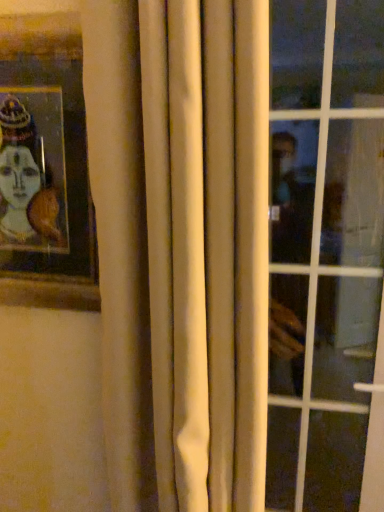
What do you see at coordinates (324, 248) in the screenshot?
I see `transparent glass window at right` at bounding box center [324, 248].

Locate an element on the screen. Image resolution: width=384 pixels, height=512 pixels. white fabric curtain at center is located at coordinates (207, 247).

How distant is white fabric curtain at center from wooden picture frame at upper left?

white fabric curtain at center and wooden picture frame at upper left are 11.51 inches apart.

Considering the positions of objects white fabric curtain at center and wooden picture frame at upper left in the image provided, who is in front, white fabric curtain at center or wooden picture frame at upper left?

Positioned in front is white fabric curtain at center.

From the image's perspective, which is above, white fabric curtain at center or wooden picture frame at upper left?

wooden picture frame at upper left.

Considering the relative sizes of white fabric curtain at center and wooden picture frame at upper left in the image provided, is white fabric curtain at center thinner than wooden picture frame at upper left?

In fact, white fabric curtain at center might be wider than wooden picture frame at upper left.

From a real-world perspective, which is physically below, wooden picture frame at upper left or white fabric curtain at center?

white fabric curtain at center.

Between wooden picture frame at upper left and white fabric curtain at center, which one has less height?

wooden picture frame at upper left.

Where is `curtain directly beneath the wooden picture frame at upper left (from a real-world perspective)`? curtain directly beneath the wooden picture frame at upper left (from a real-world perspective) is located at coordinates (207, 247).

Which is less distant, [299,326] or [226,102]?

Positioned in front is point [226,102].

From the picture: Which object is positioned more to the right, transparent glass window at right or white fabric curtain at center?

transparent glass window at right is more to the right.

Is transparent glass window at right beside white fabric curtain at center?

transparent glass window at right and white fabric curtain at center are not in contact.

Is transparent glass window at right positioned beyond the bounds of white fabric curtain at center?

Yes.

Who is taller, transparent glass window at right or wooden picture frame at upper left?

With more height is transparent glass window at right.

Is there a large distance between transparent glass window at right and wooden picture frame at upper left?

No, transparent glass window at right is in close proximity to wooden picture frame at upper left.

Considering the points (274, 498) and (62, 153), which point is behind, point (274, 498) or point (62, 153)?

The point (274, 498) is farther from the camera.

Considering the sizes of objects transparent glass window at right and wooden picture frame at upper left in the image provided, who is smaller, transparent glass window at right or wooden picture frame at upper left?

wooden picture frame at upper left.

In terms of width, does white fabric curtain at center look wider or thinner when compared to transparent glass window at right?

Clearly, white fabric curtain at center has more width compared to transparent glass window at right.

Would you consider white fabric curtain at center to be distant from transparent glass window at right?

Actually, white fabric curtain at center and transparent glass window at right are a little close together.

Could you tell me if white fabric curtain at center is turned towards transparent glass window at right?

No.

Which object is closer to the camera, white fabric curtain at center or transparent glass window at right?

white fabric curtain at center.

There is a transparent glass window at right. At what (x,y) coordinates should I click in order to perform the action: click on picture frame above it (from a real-world perspective). Please return your answer as a coordinate pair (x, y). This screenshot has width=384, height=512. Looking at the image, I should click on (45, 167).

Which is more to the right, wooden picture frame at upper left or transparent glass window at right?

transparent glass window at right.

From the image's perspective, relative to transparent glass window at right, is wooden picture frame at upper left above or below?

From the image's perspective, wooden picture frame at upper left appears above transparent glass window at right.

Are wooden picture frame at upper left and transparent glass window at right located far from each other?

No, wooden picture frame at upper left is not far from transparent glass window at right.

Where is `curtain in front of the wooden picture frame at upper left`? Image resolution: width=384 pixels, height=512 pixels. curtain in front of the wooden picture frame at upper left is located at coordinates (207, 247).

Find the location of a particular element. curtain on the right of wooden picture frame at upper left is located at coordinates (207, 247).

Which object lies nearer to the anchor point white fabric curtain at center, wooden picture frame at upper left or transparent glass window at right?

wooden picture frame at upper left is positioned closer to the anchor white fabric curtain at center.

Looking at the image, which one is located closer to transparent glass window at right, wooden picture frame at upper left or white fabric curtain at center?

white fabric curtain at center lies closer to transparent glass window at right than the other object.

Based on their spatial positions, is transparent glass window at right or wooden picture frame at upper left closer to white fabric curtain at center?

Based on the image, wooden picture frame at upper left appears to be nearer to white fabric curtain at center.

Estimate the real-world distances between objects in this image. Which object is closer to wooden picture frame at upper left, transparent glass window at right or white fabric curtain at center?

white fabric curtain at center.

Considering their positions, is white fabric curtain at center positioned further to wooden picture frame at upper left than transparent glass window at right?

Based on the image, transparent glass window at right appears to be further to wooden picture frame at upper left.

Estimate the real-world distances between objects in this image. Which object is closer to transparent glass window at right, white fabric curtain at center or wooden picture frame at upper left?

The object closer to transparent glass window at right is white fabric curtain at center.

Locate an element on the screen. curtain located between wooden picture frame at upper left and transparent glass window at right in the left-right direction is located at coordinates (207, 247).